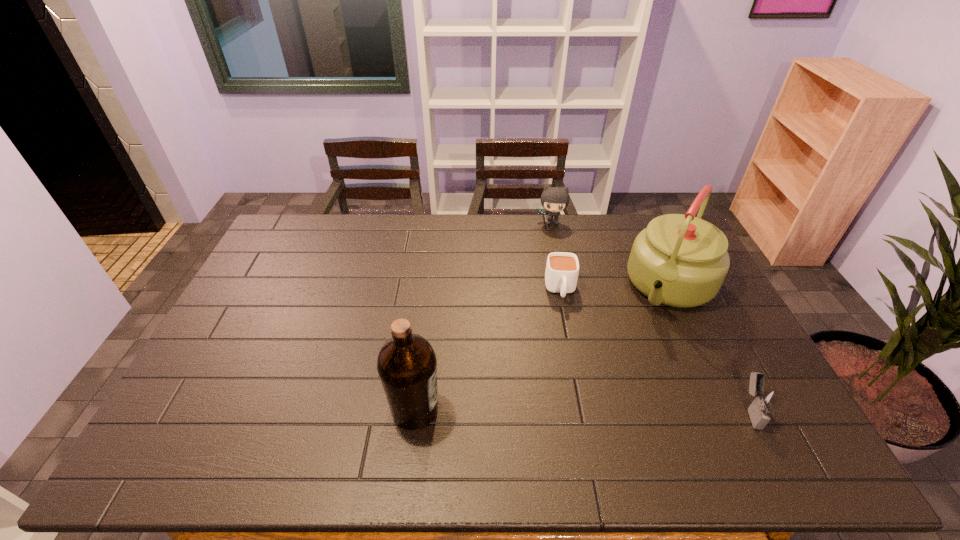
The height and width of the screenshot is (540, 960). In order to click on vacant space on the desktop that is between the leftmost object and the second shortest object and is positioned on the side with the handle of the cup in this screenshot , I will do `click(575, 409)`.

You are a GUI agent. You are given a task and a screenshot of the screen. Output one action in this format:
    pyautogui.click(x=<x>, y=<y>)
    Task: Click on the free spot on the desktop that is between the olive oil and the fourth tallest object and is positioned at the spout of the kettle
    Image resolution: width=960 pixels, height=540 pixels.
    Given the screenshot: What is the action you would take?
    coord(598,409)

The height and width of the screenshot is (540, 960). What are the coordinates of `vacant space on the desktop that is between the leftmost object and the igniter and is positioned on the front-facing side of the kitten` in the screenshot? It's located at (546, 409).